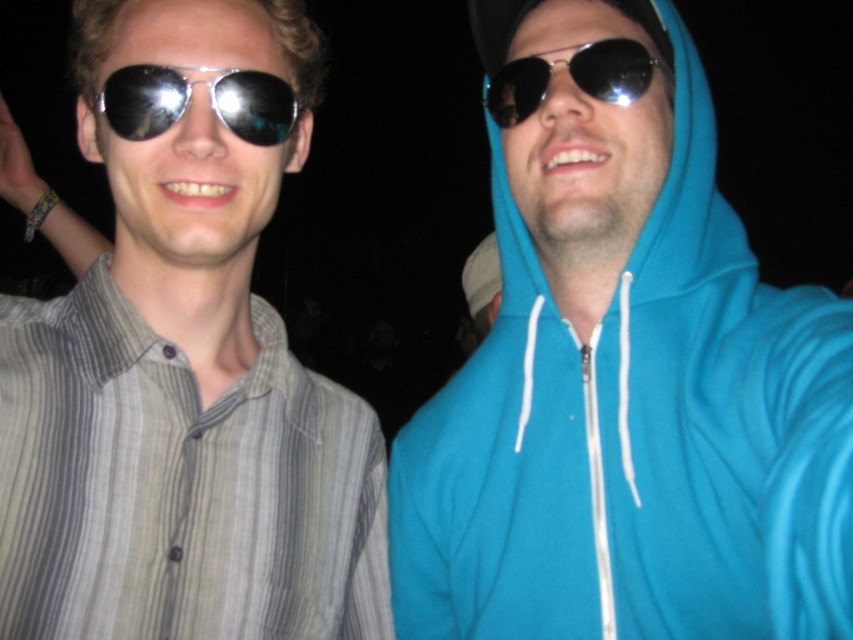
Question: Which point appears closest to the camera in this image?

Choices:
 (A) (624, 45)
 (B) (146, 122)
 (C) (751, 620)

Answer: (C)

Question: Which point is closer to the camera?

Choices:
 (A) (242, 90)
 (B) (598, 92)

Answer: (B)

Question: Does metallic reflective sunglasses at left appear under metallic reflective sunglasses at center?

Choices:
 (A) no
 (B) yes

Answer: (B)

Question: Can you confirm if teal fleece hoodie at center is positioned below metallic reflective sunglasses at left?

Choices:
 (A) no
 (B) yes

Answer: (B)

Question: Which point is closer to the camera?

Choices:
 (A) striped cotton shirt at left
 (B) metallic reflective sunglasses at center
 (C) metallic reflective sunglasses at left

Answer: (A)

Question: Is teal fleece hoodie at center positioned in front of metallic reflective sunglasses at left?

Choices:
 (A) yes
 (B) no

Answer: (A)